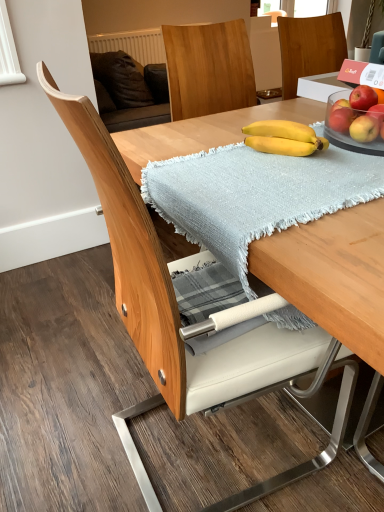
Question: Does red matte apple at upper right, which is the 4th apple in bottom-to-top order, have a greater width compared to light blue woven blanket at center?

Choices:
 (A) yes
 (B) no

Answer: (B)

Question: Is red matte apple at upper right, arranged as the first apple when viewed from the top, oriented towards light blue woven blanket at center?

Choices:
 (A) yes
 (B) no

Answer: (A)

Question: From the image's perspective, is red matte apple at upper right, arranged as the first apple when viewed from the top, located beneath light blue woven blanket at center?

Choices:
 (A) yes
 (B) no

Answer: (B)

Question: Is red matte apple at upper right, arranged as the first apple when viewed from the top, not near light blue woven blanket at center?

Choices:
 (A) no
 (B) yes

Answer: (A)

Question: Is red matte apple at upper right, which is the 4th apple in bottom-to-top order, taller than light blue woven blanket at center?

Choices:
 (A) yes
 (B) no

Answer: (A)

Question: Is red matte apple at upper right, arranged as the first apple when viewed from the top, thinner than light blue woven blanket at center?

Choices:
 (A) no
 (B) yes

Answer: (B)

Question: Is the position of red matte apple at upper right, acting as the second apple starting from the bottom, more distant than that of red matte apple at upper right, which is the 4th apple in bottom-to-top order?

Choices:
 (A) no
 (B) yes

Answer: (B)

Question: Does red matte apple at upper right, acting as the second apple starting from the bottom, appear on the left side of red matte apple at upper right, arranged as the first apple when viewed from the top?

Choices:
 (A) no
 (B) yes

Answer: (B)

Question: Is red matte apple at upper right, which is the 4th apple in bottom-to-top order, at the back of red matte apple at upper right, acting as the second apple starting from the bottom?

Choices:
 (A) yes
 (B) no

Answer: (B)

Question: Are red matte apple at upper right, the 3th apple in the top-to-bottom sequence, and red matte apple at upper right, which is the 4th apple in bottom-to-top order, located far from each other?

Choices:
 (A) yes
 (B) no

Answer: (B)

Question: Considering the relative positions of red matte apple at upper right, the 3th apple in the top-to-bottom sequence, and red matte apple at upper right, arranged as the first apple when viewed from the top, in the image provided, is red matte apple at upper right, the 3th apple in the top-to-bottom sequence, to the right of red matte apple at upper right, arranged as the first apple when viewed from the top, from the viewer's perspective?

Choices:
 (A) no
 (B) yes

Answer: (A)

Question: Can you confirm if red matte apple at upper right, the 3th apple in the top-to-bottom sequence, is thinner than red matte apple at upper right, which is the 4th apple in bottom-to-top order?

Choices:
 (A) yes
 (B) no

Answer: (A)

Question: Is the position of wooden chair at center more distant than that of matte yellow apple at right, the fourth apple viewed from the top?

Choices:
 (A) yes
 (B) no

Answer: (B)